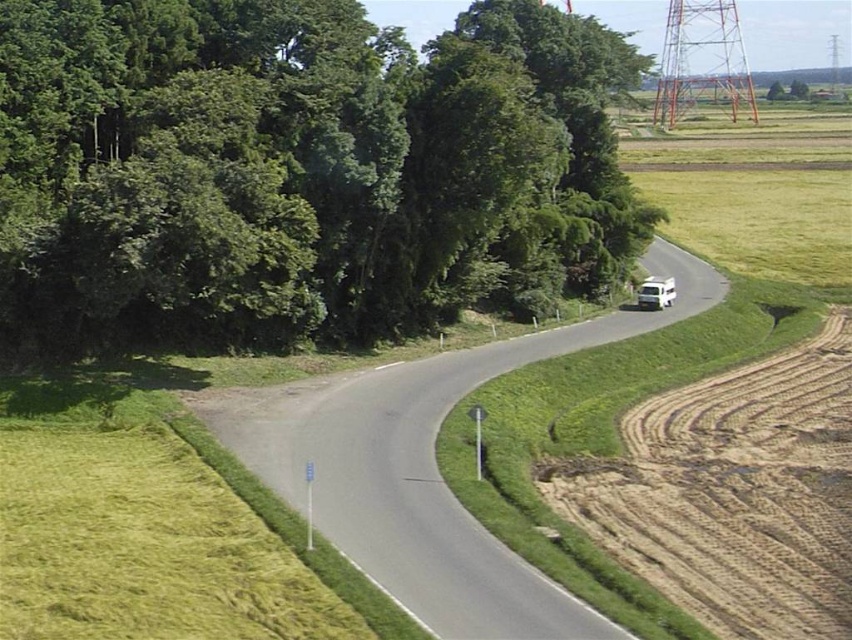
Who is more distant from viewer, (594,20) or (838,481)?

Positioned behind is point (594,20).

Consider the image. Does green leafy trees at upper left have a greater width compared to brown textured dirt track at right?

Yes.

In order to click on green leafy trees at upper left in this screenshot , I will do `click(297, 170)`.